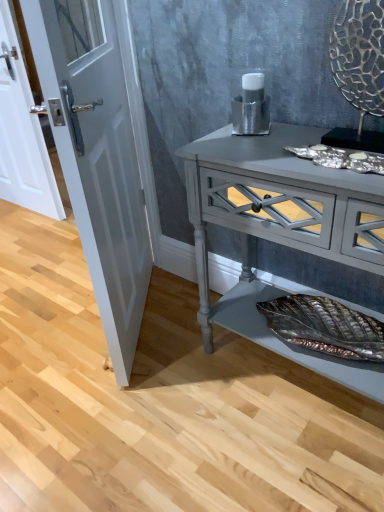
The height and width of the screenshot is (512, 384). What are the coordinates of `free space to the left of white glossy door at left, arranged as the first door when viewed from the right` in the screenshot? It's located at (45, 323).